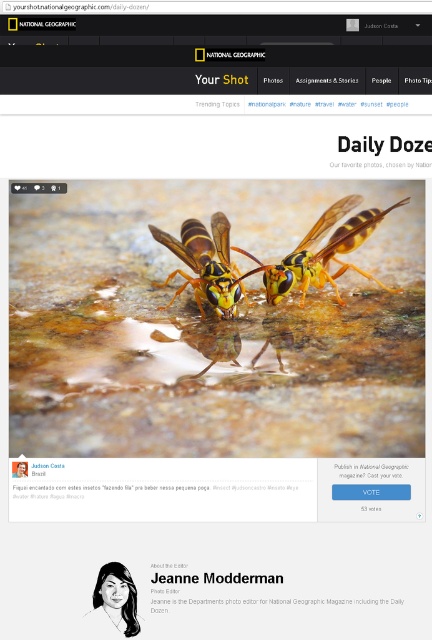
Question: Considering the relative positions of yellow matte wasp at center and black paper text at center in the image provided, where is yellow matte wasp at center located with respect to black paper text at center?

Choices:
 (A) right
 (B) left

Answer: (A)

Question: Is yellow matte wasp at center positioned at the back of black paper text at center?

Choices:
 (A) yes
 (B) no

Answer: (A)

Question: Which object appears closest to the camera in this image?

Choices:
 (A) yellow striped wasp at center
 (B) black paper text at center
 (C) yellow matte wasp at center

Answer: (B)

Question: Which object is the farthest from the yellow matte wasp at center?

Choices:
 (A) yellow striped wasp at center
 (B) black paper text at center

Answer: (B)

Question: Is yellow striped wasp at center bigger than black paper text at center?

Choices:
 (A) no
 (B) yes

Answer: (B)

Question: Which object appears closest to the camera in this image?

Choices:
 (A) yellow matte wasp at center
 (B) black paper text at center
 (C) yellow striped wasp at center

Answer: (B)